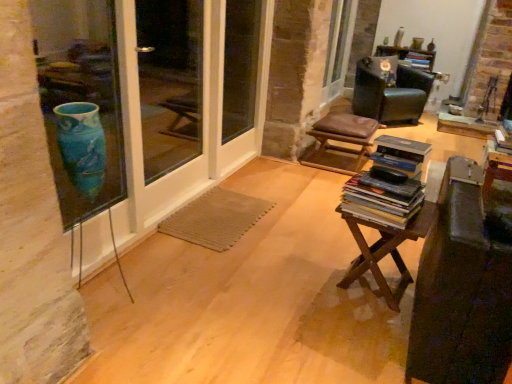
Question: In the image, is hardcover book at upper right, which is counted as the 1th book, starting from the back, positioned in front of or behind hardcover books at center, which is the 1th book in left-to-right order?

Choices:
 (A) behind
 (B) front

Answer: (A)

Question: Choose the correct answer: Is hardcover book at upper right, which is counted as the 1th book, starting from the back, inside hardcover books at center, which ranks as the 2th book in right-to-left order, or outside it?

Choices:
 (A) outside
 (B) inside

Answer: (A)

Question: Which object is the closest to the hardcover books at center, the second book from the top?

Choices:
 (A) black leather chair at upper right
 (B) brown leather stool at center
 (C) wooden at center
 (D) hardcover book at upper right, the second book ordered from the bottom
 (E) clear glass screen door at left

Answer: (C)

Question: Estimate the real-world distances between objects in this image. Which object is farther from the brown leather stool at center?

Choices:
 (A) blue glass vase at left
 (B) clear glass screen door at left
 (C) hardcover books at center, which is the 1th book in left-to-right order
 (D) black leather chair at upper right
 (E) wooden at center

Answer: (A)